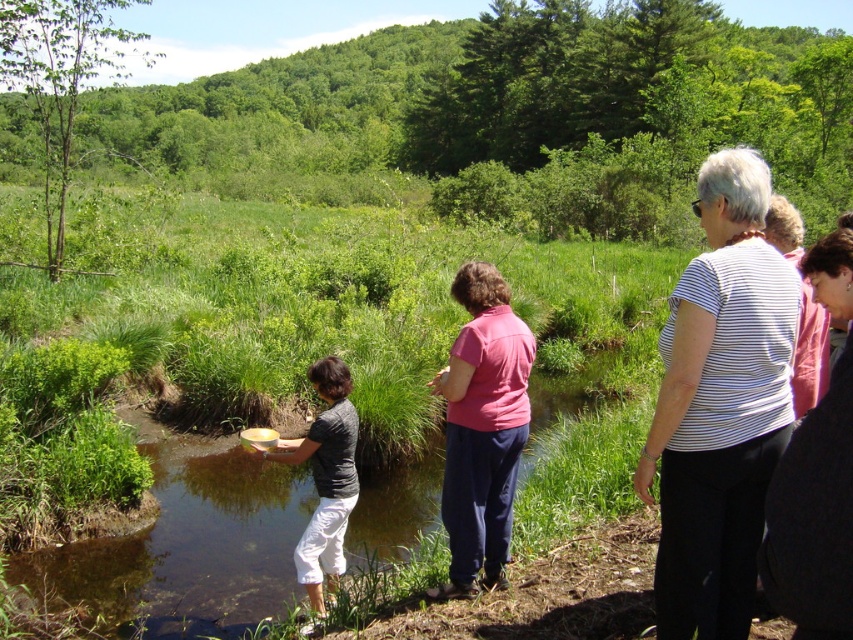
Which of these two, white striped shirt at right or pink cotton shirt at center, stands shorter?

pink cotton shirt at center is shorter.

This screenshot has width=853, height=640. What do you see at coordinates (720, 404) in the screenshot?
I see `white striped shirt at right` at bounding box center [720, 404].

You are a GUI agent. You are given a task and a screenshot of the screen. Output one action in this format:
    pyautogui.click(x=<x>, y=<y>)
    Task: Click on the white striped shirt at right
    The width and height of the screenshot is (853, 640).
    Given the screenshot: What is the action you would take?
    pyautogui.click(x=720, y=404)